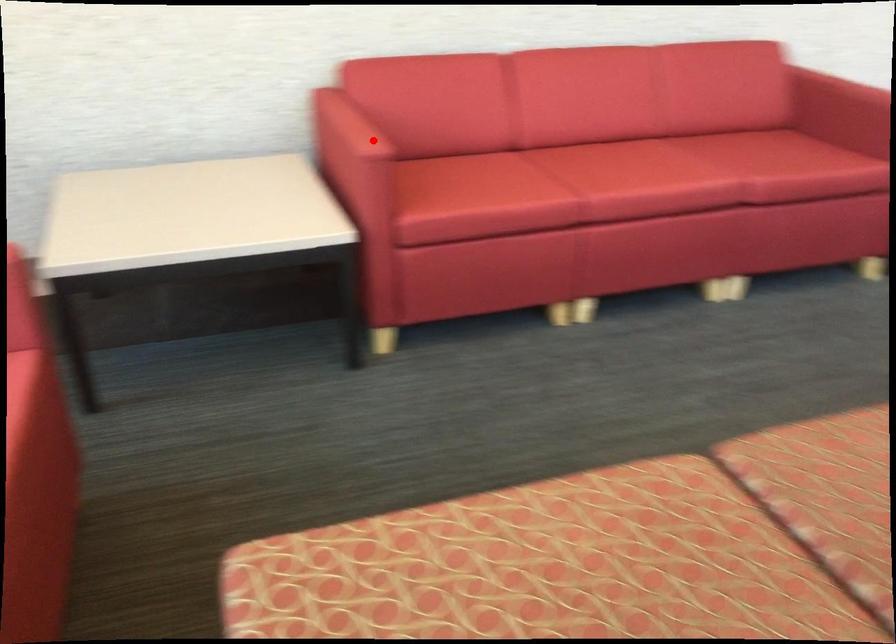
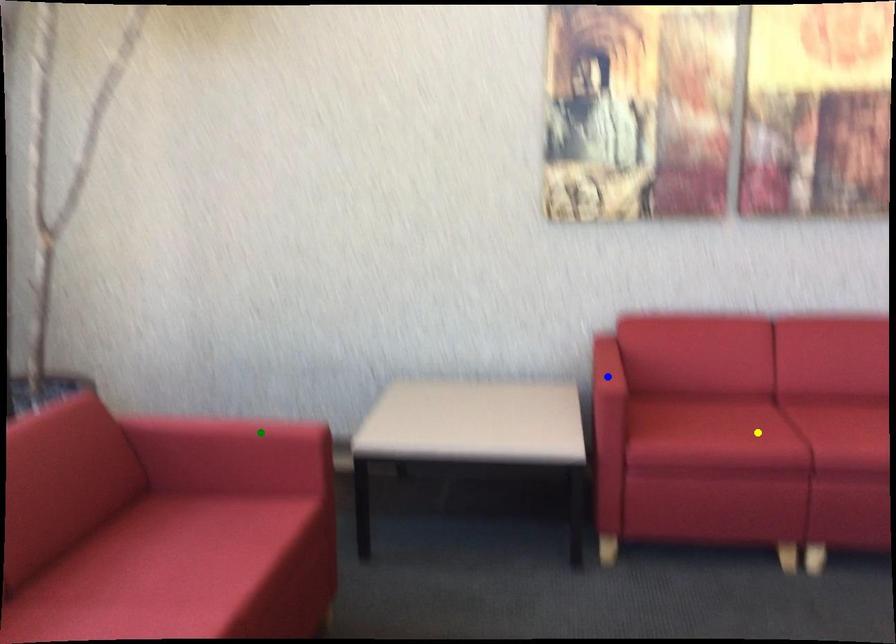
Question: I am providing you with two images of the same scene from different viewpoints. A red point is marked on the first image. You are given multiple points on the second image. Which spot in image 2 lines up with the point in image 1?

Choices:
 (A) blue point
 (B) green point
 (C) yellow point

Answer: (A)